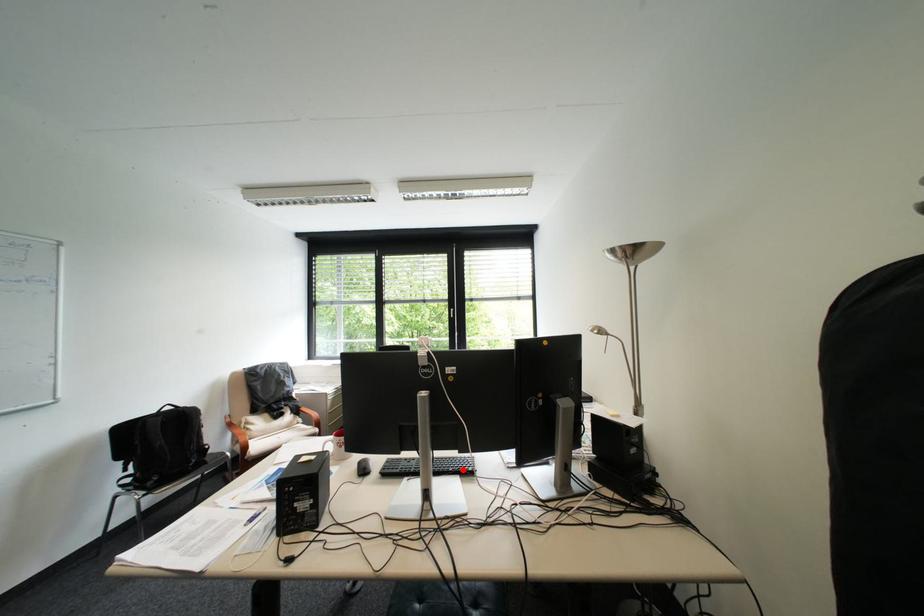
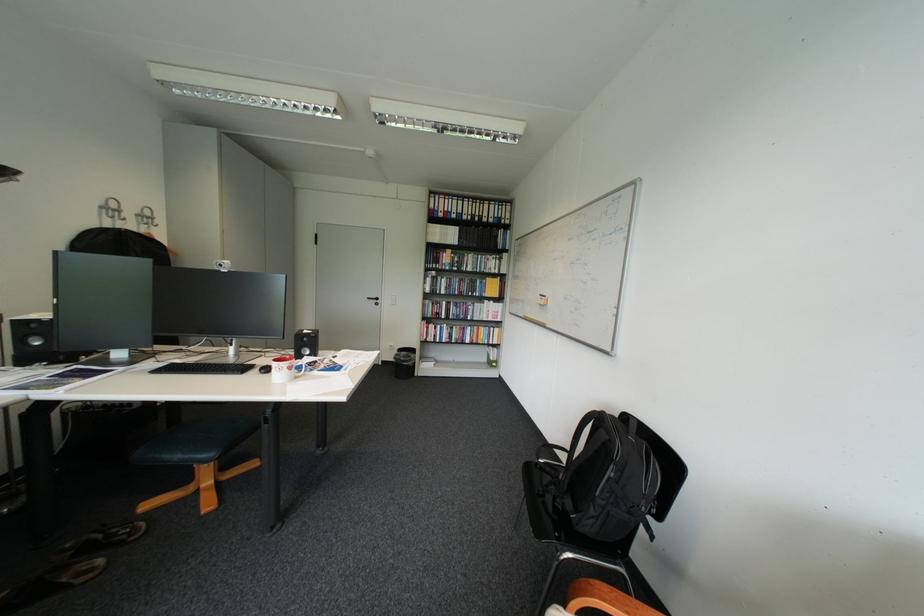
Question: A red point is marked in image1. In image2, is the corresponding 3D point closer to the camera or farther? Reply with the corresponding letter.

Choices:
 (A) The corresponding 3D point is closer.
 (B) The corresponding 3D point is farther.

Answer: (A)